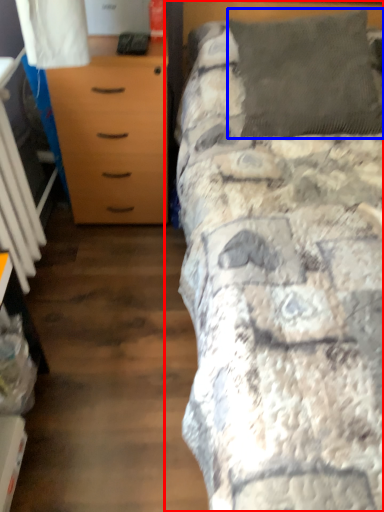
Question: Which object is closer to the camera taking this photo, bed (highlighted by a red box) or pillow (highlighted by a blue box)?

Choices:
 (A) bed
 (B) pillow

Answer: (A)